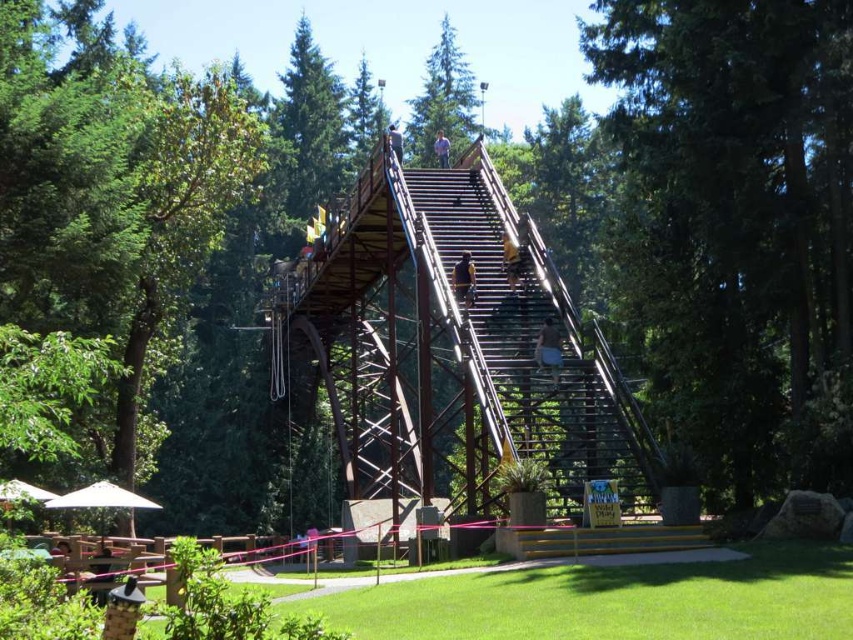
You are standing at the base of the inclined wooden structure in the park. You notice two points marked on the structure. One is at coordinate point (701, 20) and the other at point (465, 113). Which of these points is closer to you?

Point (701, 20) is closer to the viewer than point (465, 113), so the point at coordinate (701, 20) is closer to you.

You are a safety inspector evaluating the park facilities. You notice a metallic helmet at lower left and a camera somewhere in the scene. According to the safety guidelines, the maximum allowed distance between safety equipment and surveillance cameras must not exceed 30 meters for effective monitoring. Is the current placement compliant with the guidelines?

The metallic helmet at lower left and camera are 37.24 meters apart, which exceeds the 30 meters limit. Therefore, the placement is not compliant with the guidelines.